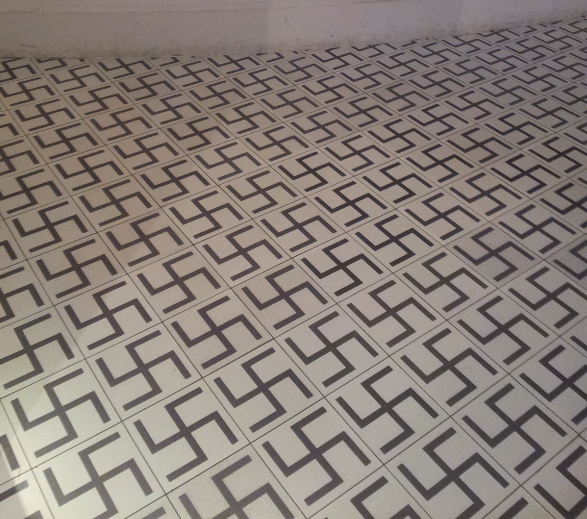
The height and width of the screenshot is (519, 587). Find the location of `tile`. tile is located at coordinates (522, 263).